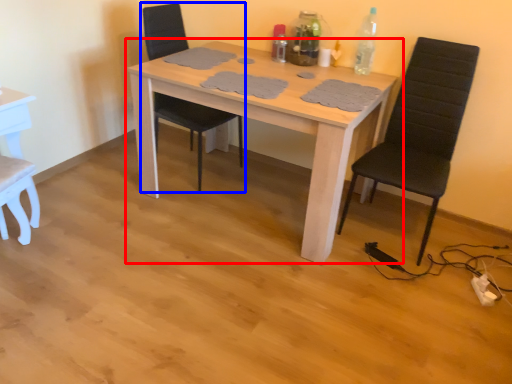
Question: Which of the following is the farthest to the observer, table (highlighted by a red box) or chair (highlighted by a blue box)?

Choices:
 (A) table
 (B) chair

Answer: (B)